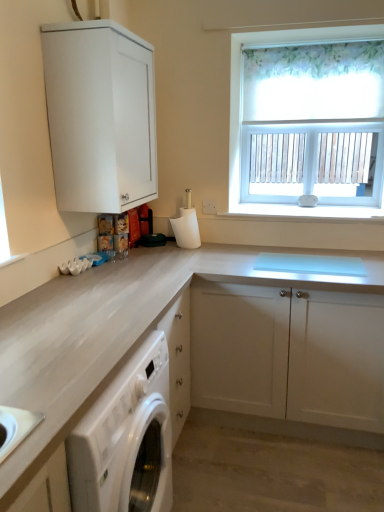
Question: Is white matte cabinet at upper left, marked as the 1th cabinetry in a top-to-bottom arrangement, beside white floral roller blind at upper right?

Choices:
 (A) no
 (B) yes

Answer: (A)

Question: Is white matte cabinet at upper left, placed as the second cabinetry when sorted from bottom to top, aimed at white floral roller blind at upper right?

Choices:
 (A) no
 (B) yes

Answer: (A)

Question: From the image's perspective, is white matte cabinet at upper left, marked as the 1th cabinetry in a top-to-bottom arrangement, located above white floral roller blind at upper right?

Choices:
 (A) no
 (B) yes

Answer: (A)

Question: Is white matte cabinet at upper left, placed as the second cabinetry when sorted from bottom to top, to the left of white floral roller blind at upper right from the viewer's perspective?

Choices:
 (A) no
 (B) yes

Answer: (B)

Question: Is white matte cabinet at upper left, marked as the 1th cabinetry in a top-to-bottom arrangement, oriented away from white floral roller blind at upper right?

Choices:
 (A) yes
 (B) no

Answer: (B)

Question: Based on their positions, is white matte cabinet at center, the 1th cabinetry from the bottom, located to the left or right of white floral roller blind at upper right?

Choices:
 (A) left
 (B) right

Answer: (A)

Question: Looking at their shapes, would you say white matte cabinet at center, positioned as the 2th cabinetry in top-to-bottom order, is wider or thinner than white floral roller blind at upper right?

Choices:
 (A) wide
 (B) thin

Answer: (A)

Question: In terms of height, does white matte cabinet at center, the 1th cabinetry from the bottom, look taller or shorter compared to white floral roller blind at upper right?

Choices:
 (A) short
 (B) tall

Answer: (A)

Question: In terms of size, does white matte cabinet at center, positioned as the 2th cabinetry in top-to-bottom order, appear bigger or smaller than white floral roller blind at upper right?

Choices:
 (A) small
 (B) big

Answer: (B)

Question: In the image, is white floral roller blind at upper right on the left side or the right side of white glossy washing machine at lower left?

Choices:
 (A) left
 (B) right

Answer: (B)

Question: In terms of height, does white floral roller blind at upper right look taller or shorter compared to white glossy washing machine at lower left?

Choices:
 (A) tall
 (B) short

Answer: (A)

Question: In terms of size, does white floral roller blind at upper right appear bigger or smaller than white glossy washing machine at lower left?

Choices:
 (A) small
 (B) big

Answer: (A)

Question: Is point (249, 208) closer or farther from the camera than point (124, 421)?

Choices:
 (A) farther
 (B) closer

Answer: (A)

Question: From the image's perspective, is white matte cabinet at upper left, marked as the 1th cabinetry in a top-to-bottom arrangement, above or below white matte cabinet at center, the 1th cabinetry from the bottom?

Choices:
 (A) below
 (B) above

Answer: (B)

Question: From a real-world perspective, is white matte cabinet at upper left, marked as the 1th cabinetry in a top-to-bottom arrangement, positioned above or below white matte cabinet at center, positioned as the 2th cabinetry in top-to-bottom order?

Choices:
 (A) above
 (B) below

Answer: (A)